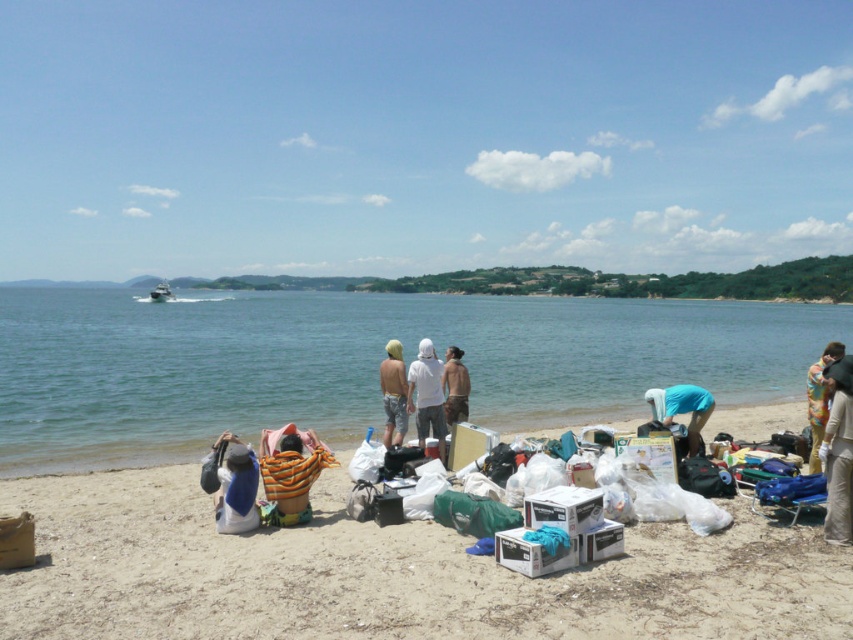
Which is more to the left, camouflage shorts at center or white plastic boat at center-left?

From the viewer's perspective, white plastic boat at center-left appears more on the left side.

Is camouflage shorts at center shorter than white plastic boat at center-left?

Yes, camouflage shorts at center is shorter than white plastic boat at center-left.

This screenshot has width=853, height=640. I want to click on camouflage shorts at center, so click(393, 394).

Is clear blue water at center to the left of blue fabric bag at lower left from the viewer's perspective?

Yes, clear blue water at center is to the left of blue fabric bag at lower left.

Does clear blue water at center have a greater height compared to blue fabric bag at lower left?

Yes.

Locate an element on the screen. clear blue water at center is located at coordinates (360, 364).

This screenshot has width=853, height=640. Find the location of `clear blue water at center`. clear blue water at center is located at coordinates coord(360,364).

Does beige sandy beach at lower center have a greater height compared to multicolored fabric bag at lower right?

No.

Does beige sandy beach at lower center have a lesser height compared to multicolored fabric bag at lower right?

Correct, beige sandy beach at lower center is not as tall as multicolored fabric bag at lower right.

Find the location of `beige sandy beach at lower center`. beige sandy beach at lower center is located at coordinates (389, 573).

I want to click on beige sandy beach at lower center, so click(389, 573).